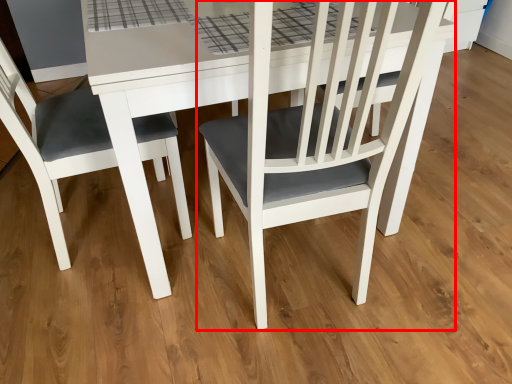
Question: From the image's perspective, where is chair (annotated by the red box) located relative to chair?

Choices:
 (A) above
 (B) below

Answer: (A)